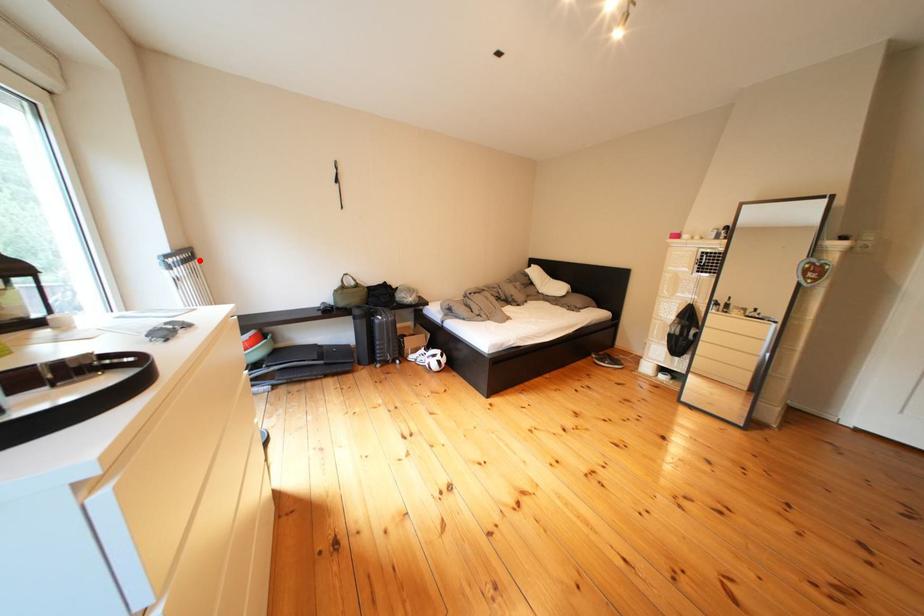
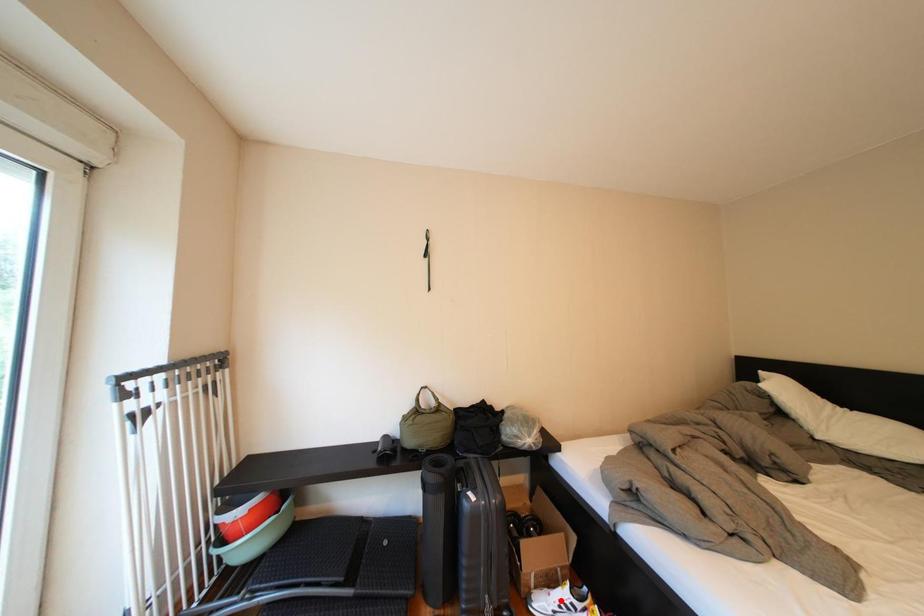
I am providing you with two images of the same scene from different viewpoints. A red point is marked on the first image and another point is marked on the second image. Is the marked point in image1 the same physical position as the marked point in image2?

No